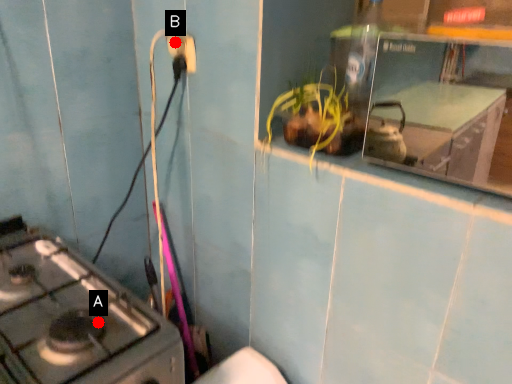
Question: Two points are circled on the image, labeled by A and B beside each circle. Which point is farther from the camera taking this photo?

Choices:
 (A) A is further
 (B) B is further

Answer: (B)